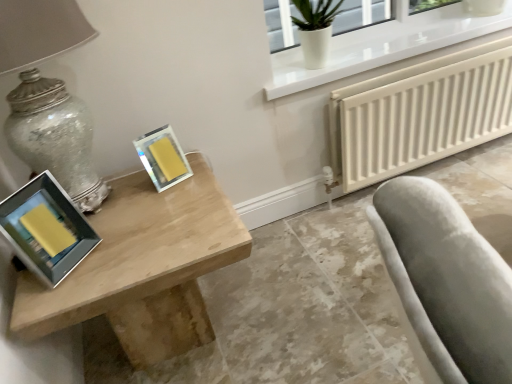
Locate an element on the screen. free region under white textured radiator at lower right (from a real-world perspective) is located at coordinates (454, 164).